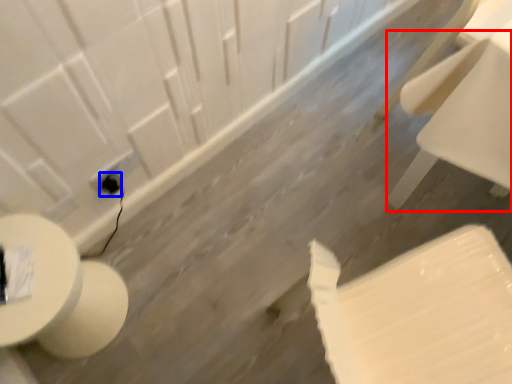
Question: Which point is closer to the camera, chair (highlighted by a red box) or electric outlet (highlighted by a blue box)?

Choices:
 (A) chair
 (B) electric outlet

Answer: (A)